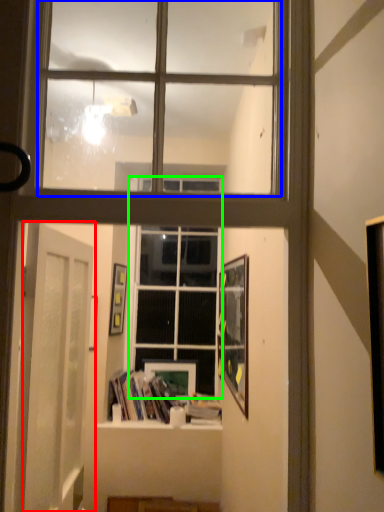
Question: Estimate the real-world distances between objects in this image. Which object is farther from door (highlighted by a red box), bay window (highlighted by a blue box) or window (highlighted by a green box)?

Choices:
 (A) bay window
 (B) window

Answer: (B)